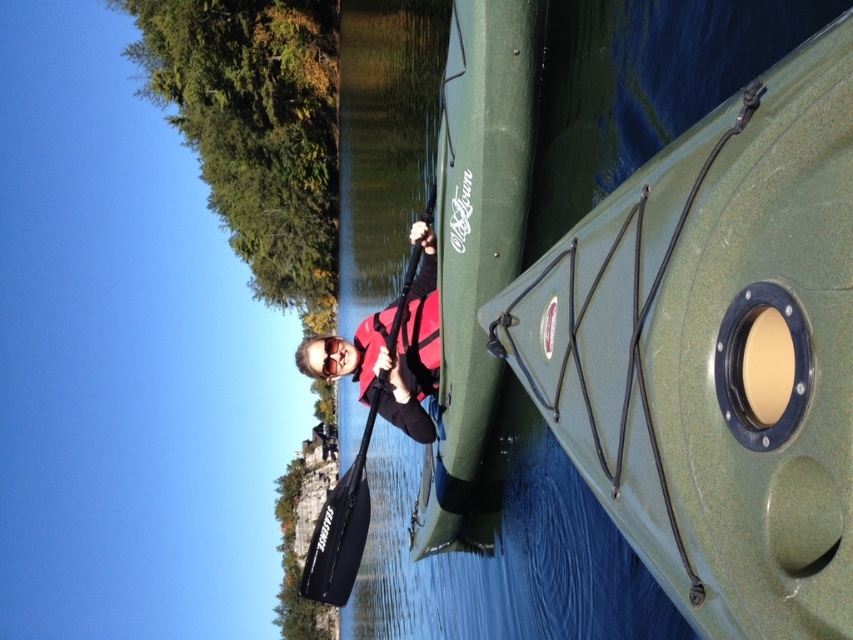
Who is shorter, green rubber kayak at center or black rubber paddle at center?

black rubber paddle at center

Is green rubber kayak at center above black rubber paddle at center?

Actually, green rubber kayak at center is below black rubber paddle at center.

Measure the distance between point (532,29) and camera.

They are 70.58 feet apart.

Locate an element on the screen. The width and height of the screenshot is (853, 640). green rubber kayak at center is located at coordinates (508, 364).

Does matte red life vest at center have a greater height compared to orange life jacket at center?

Indeed, matte red life vest at center has a greater height compared to orange life jacket at center.

Where is `matte red life vest at center`? The image size is (853, 640). matte red life vest at center is located at coordinates (387, 353).

Is point (434, 355) positioned in front of point (380, 412)?

Yes, point (434, 355) is closer to viewer.

Locate an element on the screen. This screenshot has height=640, width=853. matte red life vest at center is located at coordinates (387, 353).

Which is in front, point (669, 394) or point (393, 358)?

Point (669, 394) is more forward.

At what (x,y) coordinates should I click in order to perform the action: click on green rubber boat at center. Please return your answer as a coordinate pair (x, y). The image size is (853, 640). Looking at the image, I should click on (715, 353).